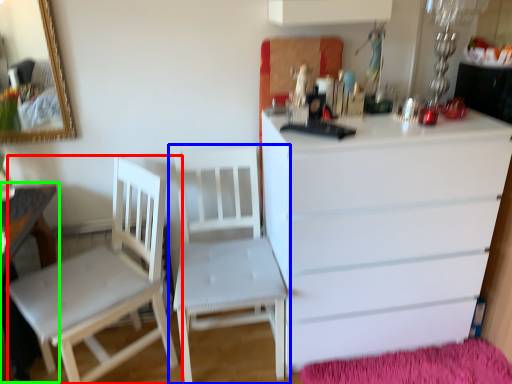
Question: Which object is the closest to the chair (highlighted by a red box)? Choose among these: chair (highlighted by a blue box) or table (highlighted by a green box).

Choices:
 (A) chair
 (B) table

Answer: (B)